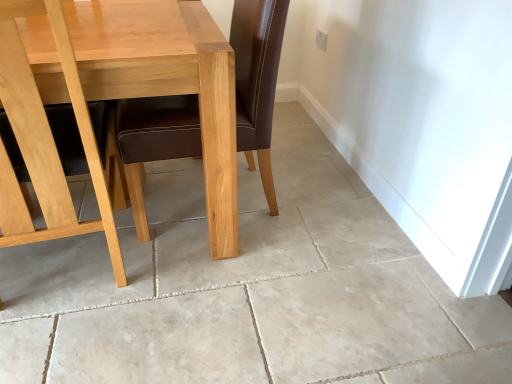
The height and width of the screenshot is (384, 512). I want to click on free space to the right of light brown wood table at center, so click(x=312, y=259).